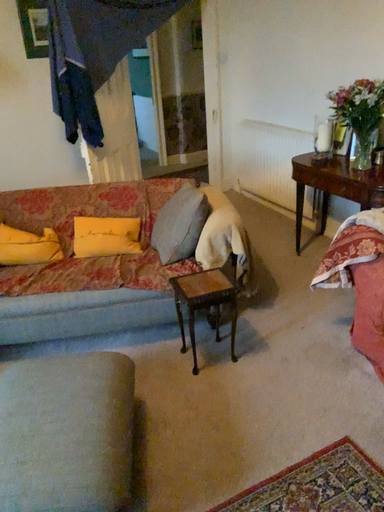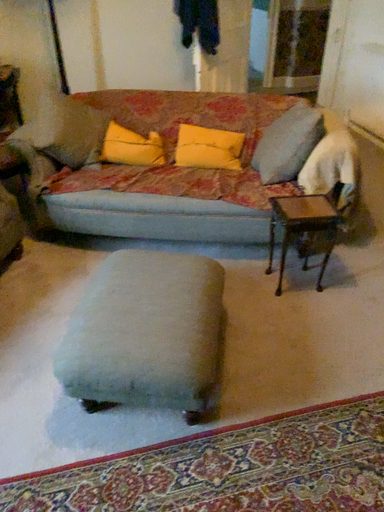
Question: How did the camera likely rotate when shooting the video?

Choices:
 (A) rotated right
 (B) rotated left

Answer: (B)